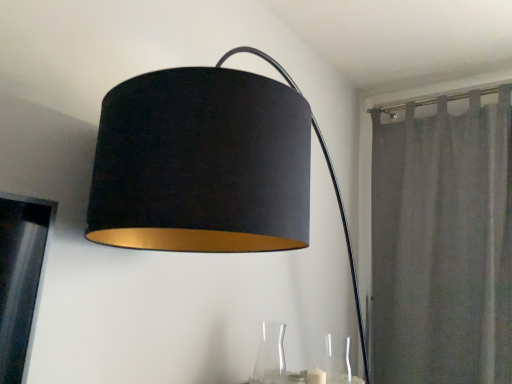
You are a GUI agent. You are given a task and a screenshot of the screen. Output one action in this format:
    pyautogui.click(x=<x>, y=<y>)
    Task: Click on the transparent glass vase at lower center, which is the 2th glass vase from right to left
    This screenshot has width=512, height=384.
    Given the screenshot: What is the action you would take?
    pyautogui.click(x=270, y=355)

Where is `gray fabric curtain at right`? The image size is (512, 384). gray fabric curtain at right is located at coordinates (442, 241).

In the image, is transparent glass vase at lower center, which is the 2th glass vase from right to left, positioned in front of or behind gray fabric curtain at right?

Visually, transparent glass vase at lower center, which is the 2th glass vase from right to left, is located in front of gray fabric curtain at right.

Is transparent glass vase at lower center, the first glass vase viewed from the left, spatially inside gray fabric curtain at right, or outside of it?

transparent glass vase at lower center, the first glass vase viewed from the left, exists outside the volume of gray fabric curtain at right.

Between point (269, 376) and point (444, 99), which one is positioned in front?

Point (269, 376)

Which object is positioned more to the left, transparent glass vase at lower center, the first glass vase viewed from the left, or gray fabric curtain at right?

transparent glass vase at lower center, the first glass vase viewed from the left.

Which of these two, white matte candle at lower center or transparent glass vase at lower right, arranged as the 1th glass vase when viewed from the right, stands shorter?

white matte candle at lower center is shorter.

Could you tell me if white matte candle at lower center is facing transparent glass vase at lower right, which is the second glass vase in left-to-right order?

No, white matte candle at lower center is not aimed at transparent glass vase at lower right, which is the second glass vase in left-to-right order.

Is the position of white matte candle at lower center less distant than that of transparent glass vase at lower right, arranged as the 1th glass vase when viewed from the right?

No, white matte candle at lower center is behind transparent glass vase at lower right, arranged as the 1th glass vase when viewed from the right.

Is gray fabric curtain at right in contact with transparent glass vase at lower right, arranged as the 1th glass vase when viewed from the right?

There is a gap between gray fabric curtain at right and transparent glass vase at lower right, arranged as the 1th glass vase when viewed from the right.

From the image's perspective, which one is positioned lower, gray fabric curtain at right or transparent glass vase at lower right, which is the second glass vase in left-to-right order?

transparent glass vase at lower right, which is the second glass vase in left-to-right order, appears lower in the image.

Between gray fabric curtain at right and transparent glass vase at lower right, arranged as the 1th glass vase when viewed from the right, which one has larger size?

Bigger between the two is gray fabric curtain at right.

Between transparent glass vase at lower right, which is the second glass vase in left-to-right order, and white matte candle at lower center, which one has smaller size?

white matte candle at lower center is smaller.

Which is farther, (335, 340) or (314, 372)?

The point (335, 340) is farther from the camera.

Based on the photo, which object is thinner, transparent glass vase at lower right, which is the second glass vase in left-to-right order, or white matte candle at lower center?

white matte candle at lower center is thinner.

Is transparent glass vase at lower right, arranged as the 1th glass vase when viewed from the right, turned away from white matte candle at lower center?

No, transparent glass vase at lower right, arranged as the 1th glass vase when viewed from the right, is not facing away from white matte candle at lower center.

Is transparent glass vase at lower right, arranged as the 1th glass vase when viewed from the right, in contact with transparent glass vase at lower center, which is the 2th glass vase from right to left?

No, transparent glass vase at lower right, arranged as the 1th glass vase when viewed from the right, is not touching transparent glass vase at lower center, which is the 2th glass vase from right to left.

Which is correct: transparent glass vase at lower right, arranged as the 1th glass vase when viewed from the right, is inside transparent glass vase at lower center, the first glass vase viewed from the left, or outside of it?

transparent glass vase at lower right, arranged as the 1th glass vase when viewed from the right, is spatially situated outside transparent glass vase at lower center, the first glass vase viewed from the left.

From the image's perspective, is transparent glass vase at lower right, which is the second glass vase in left-to-right order, over transparent glass vase at lower center, which is the 2th glass vase from right to left?

No, from the image's perspective, transparent glass vase at lower right, which is the second glass vase in left-to-right order, is not on top of transparent glass vase at lower center, which is the 2th glass vase from right to left.

Which object is thinner, transparent glass vase at lower right, arranged as the 1th glass vase when viewed from the right, or transparent glass vase at lower center, which is the 2th glass vase from right to left?

With smaller width is transparent glass vase at lower right, arranged as the 1th glass vase when viewed from the right.

Considering the positions of objects white matte candle at lower center and gray fabric curtain at right in the image provided, who is more to the right, white matte candle at lower center or gray fabric curtain at right?

gray fabric curtain at right.

Would you say white matte candle at lower center is a long distance from gray fabric curtain at right?

No.

From the image's perspective, is white matte candle at lower center on gray fabric curtain at right?

No, from the image's perspective, white matte candle at lower center is not over gray fabric curtain at right.

From the picture: Considering the sizes of objects white matte candle at lower center and transparent glass vase at lower center, which is the 2th glass vase from right to left, in the image provided, who is thinner, white matte candle at lower center or transparent glass vase at lower center, which is the 2th glass vase from right to left,?

With smaller width is white matte candle at lower center.

Find the location of a particular element. This screenshot has height=384, width=512. candle lying on the right of transparent glass vase at lower center, the first glass vase viewed from the left is located at coordinates (316, 376).

I want to click on curtain located above the transparent glass vase at lower center, which is the 2th glass vase from right to left (from a real-world perspective), so click(x=442, y=241).

Find the location of a particular element. The width and height of the screenshot is (512, 384). candle below the transparent glass vase at lower right, arranged as the 1th glass vase when viewed from the right (from the image's perspective) is located at coordinates (316, 376).

Which object lies nearer to the anchor point transparent glass vase at lower center, the first glass vase viewed from the left, gray fabric curtain at right or transparent glass vase at lower right, arranged as the 1th glass vase when viewed from the right?

The object closer to transparent glass vase at lower center, the first glass vase viewed from the left, is transparent glass vase at lower right, arranged as the 1th glass vase when viewed from the right.

Estimate the real-world distances between objects in this image. Which object is further from white matte candle at lower center, transparent glass vase at lower right, which is the second glass vase in left-to-right order, or gray fabric curtain at right?

gray fabric curtain at right is further to white matte candle at lower center.

Based on their spatial positions, is gray fabric curtain at right or white matte candle at lower center further from transparent glass vase at lower right, which is the second glass vase in left-to-right order?

Based on the image, gray fabric curtain at right appears to be further to transparent glass vase at lower right, which is the second glass vase in left-to-right order.

Which object lies further to the anchor point transparent glass vase at lower center, which is the 2th glass vase from right to left, transparent glass vase at lower right, arranged as the 1th glass vase when viewed from the right, or gray fabric curtain at right?

gray fabric curtain at right.

When comparing their distances from transparent glass vase at lower right, arranged as the 1th glass vase when viewed from the right, does transparent glass vase at lower center, the first glass vase viewed from the left, or gray fabric curtain at right seem closer?

transparent glass vase at lower center, the first glass vase viewed from the left, is positioned closer to the anchor transparent glass vase at lower right, arranged as the 1th glass vase when viewed from the right.

From the image, which object appears to be nearer to transparent glass vase at lower right, which is the second glass vase in left-to-right order, transparent glass vase at lower center, which is the 2th glass vase from right to left, or white matte candle at lower center?

white matte candle at lower center.

Which object lies nearer to the anchor point white matte candle at lower center, transparent glass vase at lower center, the first glass vase viewed from the left, or transparent glass vase at lower right, arranged as the 1th glass vase when viewed from the right?

transparent glass vase at lower right, arranged as the 1th glass vase when viewed from the right.

Estimate the real-world distances between objects in this image. Which object is further from gray fabric curtain at right, transparent glass vase at lower center, which is the 2th glass vase from right to left, or transparent glass vase at lower right, arranged as the 1th glass vase when viewed from the right?

Among the two, transparent glass vase at lower center, which is the 2th glass vase from right to left, is located further to gray fabric curtain at right.

Find the location of a particular element. Image resolution: width=512 pixels, height=384 pixels. candle situated between transparent glass vase at lower center, which is the 2th glass vase from right to left, and gray fabric curtain at right from left to right is located at coordinates (316, 376).

Where is `glass vase between transparent glass vase at lower center, the first glass vase viewed from the left, and gray fabric curtain at right`? This screenshot has height=384, width=512. glass vase between transparent glass vase at lower center, the first glass vase viewed from the left, and gray fabric curtain at right is located at coordinates (337, 359).

Identify the location of candle between transparent glass vase at lower center, the first glass vase viewed from the left, and transparent glass vase at lower right, which is the second glass vase in left-to-right order. (316, 376).

Find the location of a particular element. glass vase situated between white matte candle at lower center and gray fabric curtain at right from left to right is located at coordinates (337, 359).